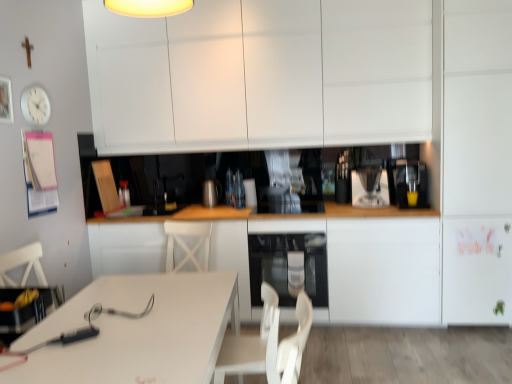
The height and width of the screenshot is (384, 512). I want to click on white plastic coffee machine at center, so click(x=410, y=184).

This screenshot has height=384, width=512. In order to click on white glossy table at lower left in this screenshot , I will do `click(136, 332)`.

What do you see at coordinates (136, 332) in the screenshot?
I see `white glossy table at lower left` at bounding box center [136, 332].

What do you see at coordinates (477, 162) in the screenshot?
I see `white matte cabinet at right, arranged as the 2th cabinetry when viewed from the top` at bounding box center [477, 162].

This screenshot has height=384, width=512. What do you see at coordinates (35, 105) in the screenshot?
I see `white plastic clock at upper left` at bounding box center [35, 105].

Image resolution: width=512 pixels, height=384 pixels. Identify the location of satin silver kettle at center, the first appliance in the left-to-right sequence. (211, 193).

From the image's perspective, would you say white matte cabinet at upper center, which is the 1th cabinetry from top to bottom, is shown under white plastic swivel chair at lower center?

Actually, white matte cabinet at upper center, which is the 1th cabinetry from top to bottom, appears above white plastic swivel chair at lower center in the image.

Can you confirm if white matte cabinet at upper center, which is the 1th cabinetry from top to bottom, is smaller than white plastic swivel chair at lower center?

No, white matte cabinet at upper center, which is the 1th cabinetry from top to bottom, is not smaller than white plastic swivel chair at lower center.

Is white matte cabinet at upper center, the 3th cabinetry in the bottom-to-top sequence, completely or partially outside of white plastic swivel chair at lower center?

Yes, white matte cabinet at upper center, the 3th cabinetry in the bottom-to-top sequence, is not within white plastic swivel chair at lower center.

Can you confirm if white matte cabinet at upper center, the 3th cabinetry in the bottom-to-top sequence, is wider than white plastic swivel chair at lower center?

Indeed, white matte cabinet at upper center, the 3th cabinetry in the bottom-to-top sequence, has a greater width compared to white plastic swivel chair at lower center.

Are satin silver kettle at center, which ranks as the 2th appliance in right-to-left order, and white matte cabinet at upper center, the 3th cabinetry in the bottom-to-top sequence, far apart?

Indeed, satin silver kettle at center, which ranks as the 2th appliance in right-to-left order, is not near white matte cabinet at upper center, the 3th cabinetry in the bottom-to-top sequence.

Is satin silver kettle at center, which ranks as the 2th appliance in right-to-left order, facing towards white matte cabinet at upper center, the 3th cabinetry in the bottom-to-top sequence?

No, satin silver kettle at center, which ranks as the 2th appliance in right-to-left order, is not oriented towards white matte cabinet at upper center, the 3th cabinetry in the bottom-to-top sequence.

Could white matte cabinet at upper center, the 3th cabinetry in the bottom-to-top sequence, be considered to be inside satin silver kettle at center, the first appliance in the left-to-right sequence?

No, white matte cabinet at upper center, the 3th cabinetry in the bottom-to-top sequence, is not inside satin silver kettle at center, the first appliance in the left-to-right sequence.

Which object is positioned more to the left, satin silver kettle at center, which ranks as the 2th appliance in right-to-left order, or white matte cabinet at upper center, which is the 1th cabinetry from top to bottom?

satin silver kettle at center, which ranks as the 2th appliance in right-to-left order, is more to the left.

Would you say white plastic swivel chair at lower center is a long distance from white plastic clock at upper left?

Yes, white plastic swivel chair at lower center is far from white plastic clock at upper left.

Is white plastic swivel chair at lower center positioned before white plastic clock at upper left?

That is True.

Can you confirm if white plastic swivel chair at lower center is wider than white plastic clock at upper left?

Correct, the width of white plastic swivel chair at lower center exceeds that of white plastic clock at upper left.

From a real-world perspective, is white plastic clock at upper left physically below white plastic swivel chair at lower center?

No, from a real-world perspective, white plastic clock at upper left is not beneath white plastic swivel chair at lower center.

How much distance is there between white plastic clock at upper left and white plastic swivel chair at lower center?

A distance of 1.93 meters exists between white plastic clock at upper left and white plastic swivel chair at lower center.

The width and height of the screenshot is (512, 384). Identify the location of swivel chair that is under the white plastic clock at upper left (from a real-world perspective). (247, 344).

Could you tell me if white plastic clock at upper left is facing white plastic swivel chair at lower center?

No, white plastic clock at upper left is not facing towards white plastic swivel chair at lower center.

Would you say satin black oven at lower center is a long distance from satin silver kettle at center, which ranks as the 2th appliance in right-to-left order?

That's not correct — satin black oven at lower center is a little close to satin silver kettle at center, which ranks as the 2th appliance in right-to-left order.

Considering the sizes of objects satin black oven at lower center and satin silver kettle at center, marked as the 2th appliance in a front-to-back arrangement, in the image provided, who is shorter, satin black oven at lower center or satin silver kettle at center, marked as the 2th appliance in a front-to-back arrangement,?

With less height is satin silver kettle at center, marked as the 2th appliance in a front-to-back arrangement.

From the image's perspective, is satin black oven at lower center above or below satin silver kettle at center, marked as the 2th appliance in a front-to-back arrangement?

Clearly, from the image's perspective, satin black oven at lower center is below satin silver kettle at center, marked as the 2th appliance in a front-to-back arrangement.

Which is behind, point (254, 234) or point (216, 202)?

The point (216, 202) is farther from the camera.

Considering the sizes of satin black oven at lower center and white matte cabinet at right, which is counted as the 2th cabinetry, starting from the bottom, in the image, is satin black oven at lower center taller or shorter than white matte cabinet at right, which is counted as the 2th cabinetry, starting from the bottom,?

satin black oven at lower center is shorter than white matte cabinet at right, which is counted as the 2th cabinetry, starting from the bottom.

Could you measure the distance between satin black oven at lower center and white matte cabinet at right, arranged as the 2th cabinetry when viewed from the top?

3.96 feet.

Does satin black oven at lower center appear on the left side of white matte cabinet at right, arranged as the 2th cabinetry when viewed from the top?

Indeed, satin black oven at lower center is positioned on the left side of white matte cabinet at right, arranged as the 2th cabinetry when viewed from the top.

Is white plastic swivel chair at lower center turned away from satin silver kettle at center, which ranks as the 2th appliance in right-to-left order?

No, satin silver kettle at center, which ranks as the 2th appliance in right-to-left order, is not at the back of white plastic swivel chair at lower center.

Does point (268, 329) come in front of point (204, 199)?

Yes, it is.

Between white plastic swivel chair at lower center and satin silver kettle at center, the 1th appliance when ordered from back to front, which one has smaller width?

Thinner between the two is satin silver kettle at center, the 1th appliance when ordered from back to front.

Considering the positions of objects white plastic swivel chair at lower center and satin silver kettle at center, the 1th appliance when ordered from back to front, in the image provided, who is more to the left, white plastic swivel chair at lower center or satin silver kettle at center, the 1th appliance when ordered from back to front,?

satin silver kettle at center, the 1th appliance when ordered from back to front, is more to the left.

Identify the location of the 2nd cabinetry located above the white plastic swivel chair at lower center (from a real-world perspective). (260, 75).

Identify the location of the 2nd appliance below the white matte cabinet at upper center, which is the 1th cabinetry from top to bottom (from the image's perspective). The height and width of the screenshot is (384, 512). (211, 193).

Estimate the real-world distances between objects in this image. Which object is closer to white matte cabinet at right, arranged as the 2th cabinetry when viewed from the top, white matte cabinet at center, which ranks as the third cabinetry in top-to-bottom order, or sleek metallic coffee maker at center, positioned as the first appliance in front-to-back order?

Among the two, white matte cabinet at center, which ranks as the third cabinetry in top-to-bottom order, is located nearer to white matte cabinet at right, arranged as the 2th cabinetry when viewed from the top.

Looking at the image, which one is located closer to yellow matte cup at right, white matte cabinet at center, marked as the 1th cabinetry in a bottom-to-top arrangement, or white glossy table at lower left?

white matte cabinet at center, marked as the 1th cabinetry in a bottom-to-top arrangement, is positioned closer to the anchor yellow matte cup at right.

Estimate the real-world distances between objects in this image. Which object is closer to sleek metallic coffee maker at center, positioned as the first appliance in front-to-back order, white matte cabinet at center, which ranks as the third cabinetry in top-to-bottom order, or white plastic coffee machine at center?

white plastic coffee machine at center is closer to sleek metallic coffee maker at center, positioned as the first appliance in front-to-back order.

Looking at the image, which one is located closer to white matte cabinet at right, which is counted as the 2th cabinetry, starting from the bottom, satin black oven at lower center or white glossy table at lower left?

The object closer to white matte cabinet at right, which is counted as the 2th cabinetry, starting from the bottom, is satin black oven at lower center.

Which object lies further to the anchor point satin silver kettle at center, the first appliance in the left-to-right sequence, white glossy table at lower left or white plastic coffee machine at center?

white glossy table at lower left is further to satin silver kettle at center, the first appliance in the left-to-right sequence.

When comparing their distances from white matte cabinet at upper center, the 3th cabinetry in the bottom-to-top sequence, does white matte cabinet at center, marked as the 1th cabinetry in a bottom-to-top arrangement, or yellow matte cup at right seem further?

Among the two, yellow matte cup at right is located further to white matte cabinet at upper center, the 3th cabinetry in the bottom-to-top sequence.

From the image, which object appears to be farther from white plastic coffee machine at center, yellow matte cup at right or white matte cabinet at center, which ranks as the third cabinetry in top-to-bottom order?

Among the two, white matte cabinet at center, which ranks as the third cabinetry in top-to-bottom order, is located further to white plastic coffee machine at center.

Which object lies further to the anchor point white plastic coffee machine at center, white matte cabinet at center, marked as the 1th cabinetry in a bottom-to-top arrangement, or white matte cabinet at right, arranged as the 2th cabinetry when viewed from the top?

The object further to white plastic coffee machine at center is white matte cabinet at center, marked as the 1th cabinetry in a bottom-to-top arrangement.

Locate an element on the screen. The width and height of the screenshot is (512, 384). appliance between white matte cabinet at center, which ranks as the third cabinetry in top-to-bottom order, and white matte cabinet at right, which is counted as the 2th cabinetry, starting from the bottom is located at coordinates (369, 187).

Locate an element on the screen. oven between white matte cabinet at upper center, which is the 1th cabinetry from top to bottom, and white matte cabinet at right, arranged as the 2th cabinetry when viewed from the top, from left to right is located at coordinates (288, 266).

Identify the location of swivel chair located between white glossy table at lower left and white matte cabinet at right, arranged as the 2th cabinetry when viewed from the top, in the left-right direction. (247, 344).

The height and width of the screenshot is (384, 512). I want to click on oven located between satin silver kettle at center, marked as the 2th appliance in a front-to-back arrangement, and yellow matte cup at right in the left-right direction, so click(x=288, y=266).